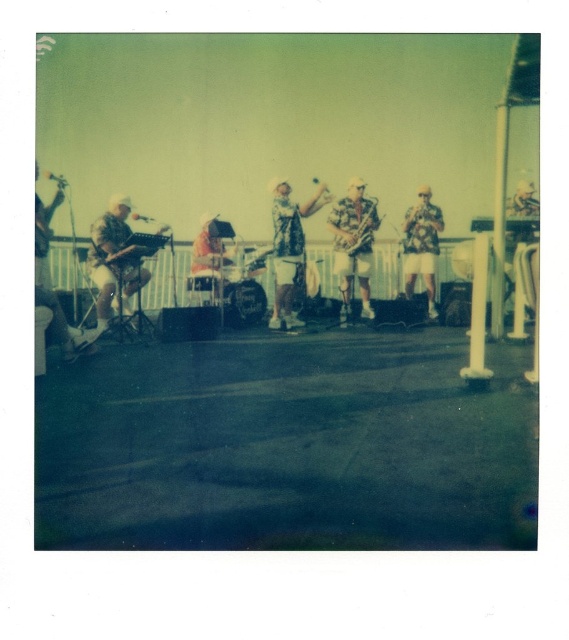
Question: Is matte brown guitar at left positioned in front of gold metallic saxophone at center?

Choices:
 (A) no
 (B) yes

Answer: (B)

Question: Can you confirm if matte brown guitar at left is thinner than wooden saxophone at center?

Choices:
 (A) yes
 (B) no

Answer: (B)

Question: Which point appears farthest from the camera in this image?

Choices:
 (A) (278, 244)
 (B) (413, 221)
 (C) (353, 253)
 (D) (125, 228)

Answer: (B)

Question: Does matte brown guitar at left have a lesser width compared to camouflage-patterned shirt at center?

Choices:
 (A) no
 (B) yes

Answer: (A)

Question: Which of the following is the farthest from the observer?

Choices:
 (A) gold metallic saxophone at center
 (B) camouflage-patterned shirt at center

Answer: (A)

Question: Which point appears closest to the camera in this image?

Choices:
 (A) (430, 269)
 (B) (364, 225)

Answer: (B)